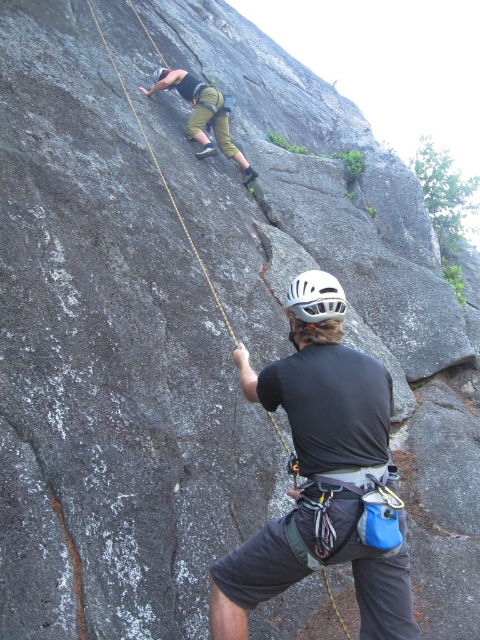
You are a safety inspector assessing the climbing gear in the image. You notice the black fabric helmet at upper center and the green fabric pants at upper center. Which of these two items has a smaller thickness?

The black fabric helmet at upper center is thinner than the green fabric pants at upper center, so the black fabric helmet at upper center has a smaller thickness.

You are a rock climber planning to set up an anchor point. You notice two items at the upper center of your view. What is the relationship between the black fabric helmet at upper center and the green fabric pants at upper center in terms of their vertical position?

The black fabric helmet at upper center is shorter than green fabric pants at upper center, meaning the helmet is positioned lower than the pants vertically.

You are a climber assessing the rock face. You see two points marked on the rock face. Which point is closer to you, point 1 at coordinates (386, 435) or point 2 at coordinates (308, 305)?

Point 1 at coordinates (386, 435) is closer to you than point 2 at coordinates (308, 305).